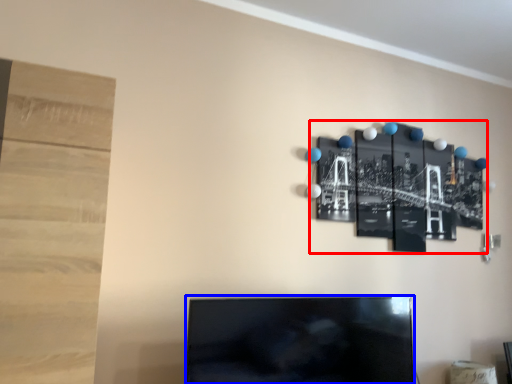
Question: Among these objects, which one is nearest to the camera, bulletin board (highlighted by a red box) or television (highlighted by a blue box)?

Choices:
 (A) bulletin board
 (B) television

Answer: (B)